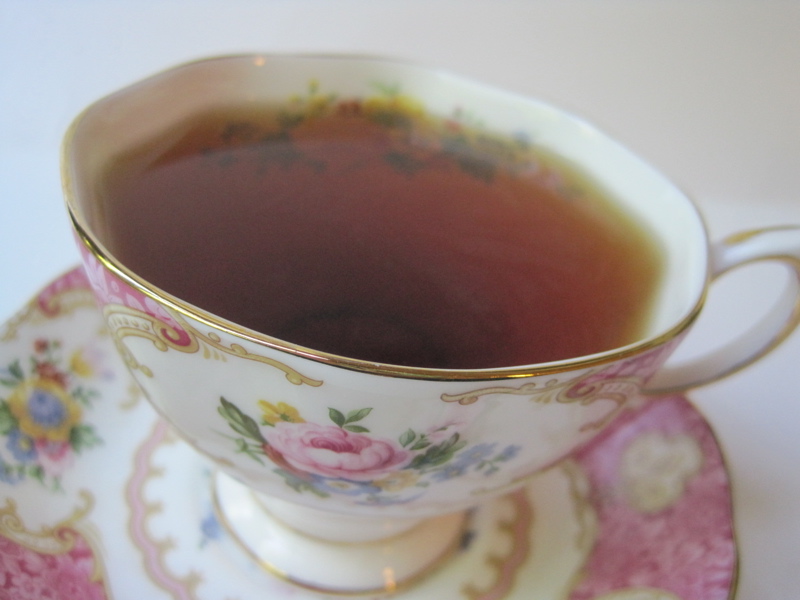
The width and height of the screenshot is (800, 600). I want to click on shadow from lighting, so click(x=752, y=498).